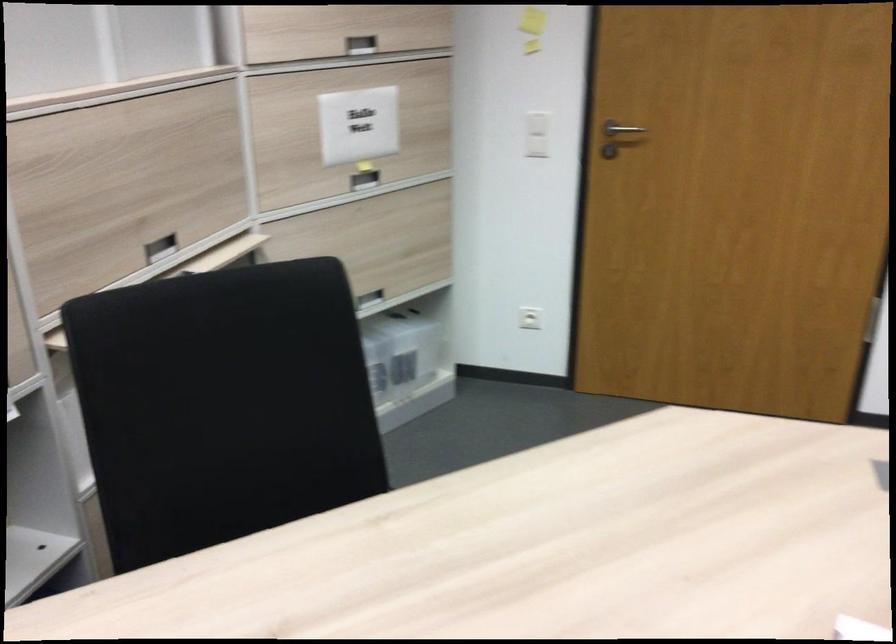
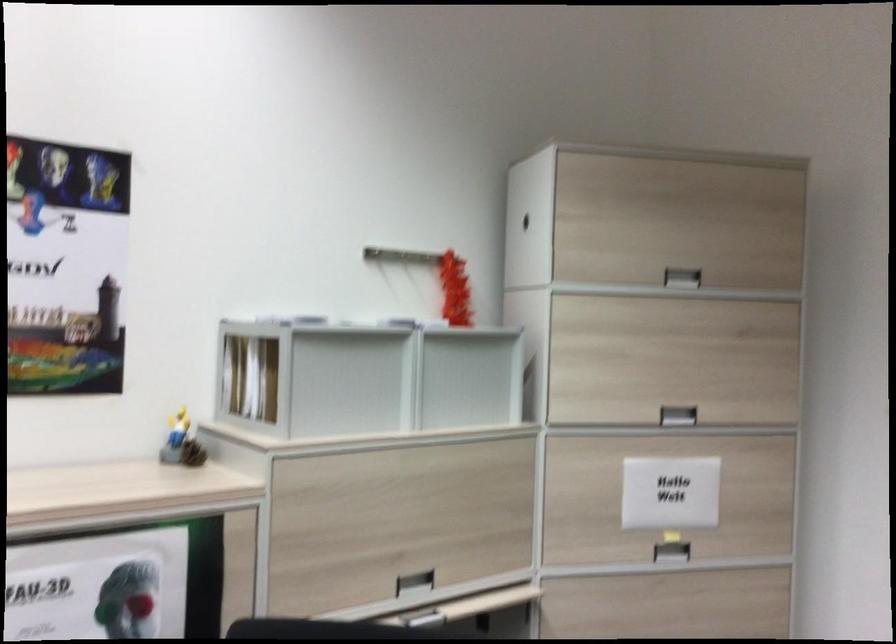
Based on the continuous images, in which direction is the camera rotating?

The camera rotated toward left-up.